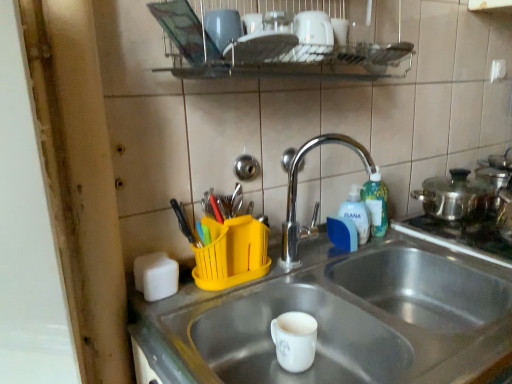
Image resolution: width=512 pixels, height=384 pixels. Find the location of `free space underneath yellow plastic utensil holder at upper center (from a real-world perspective)`. free space underneath yellow plastic utensil holder at upper center (from a real-world perspective) is located at coordinates (237, 281).